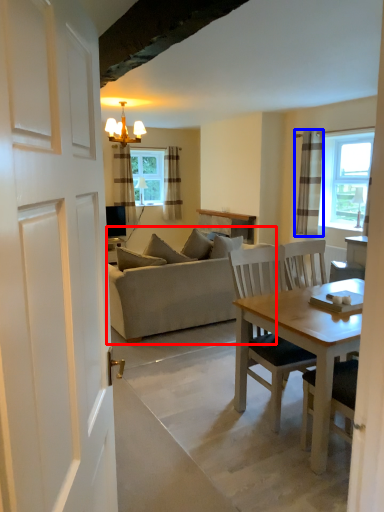
Question: Which object appears farthest to the camera in this image, studio couch (highlighted by a red box) or curtain (highlighted by a blue box)?

Choices:
 (A) studio couch
 (B) curtain

Answer: (B)